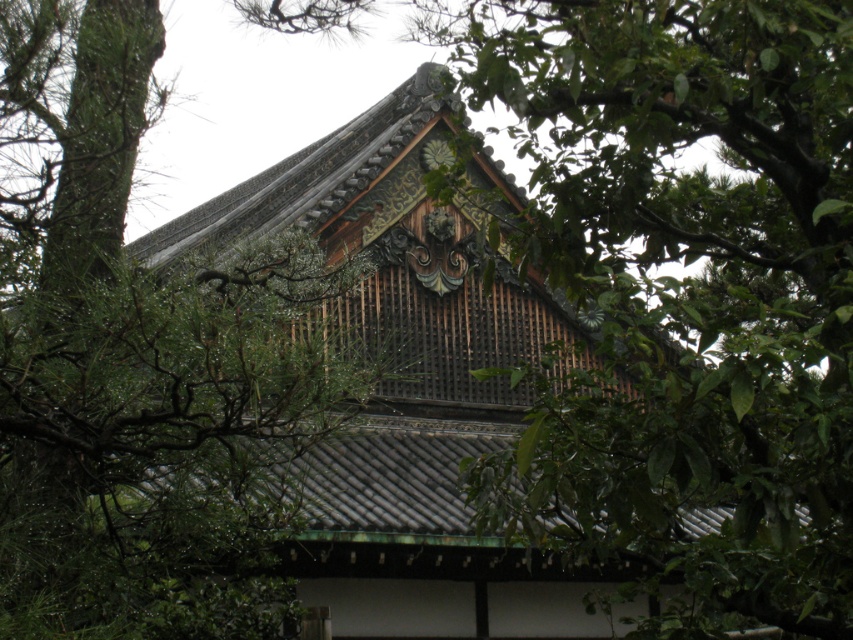
Which is more to the right, green leafy tree at upper left or shiny dark brown wooden roof at center?

From the viewer's perspective, shiny dark brown wooden roof at center appears more on the right side.

Does point (86, 408) come in front of point (428, 376)?

Yes, point (86, 408) is closer to viewer.

Between point (13, 141) and point (305, 198), which one is positioned in front?

Positioned in front is point (13, 141).

What are the coordinates of `green leafy tree at upper left` in the screenshot? It's located at (138, 364).

Measure the distance between green leafy tree at center and camera.

green leafy tree at center is 41.04 meters away from camera.

Identify the location of green leafy tree at center. (683, 292).

Locate an element on the screen. The image size is (853, 640). green leafy tree at center is located at coordinates (683, 292).

Can you confirm if green leafy tree at center is bigger than shiny dark brown wooden roof at center?

Yes, green leafy tree at center is bigger than shiny dark brown wooden roof at center.

Is green leafy tree at center taller than shiny dark brown wooden roof at center?

Yes, green leafy tree at center is taller than shiny dark brown wooden roof at center.

Where is `green leafy tree at center`? This screenshot has height=640, width=853. green leafy tree at center is located at coordinates (683, 292).

You are a GUI agent. You are given a task and a screenshot of the screen. Output one action in this format:
    pyautogui.click(x=<x>, y=<y>)
    Task: Click on the green leafy tree at center
    The height and width of the screenshot is (640, 853).
    Given the screenshot: What is the action you would take?
    pyautogui.click(x=683, y=292)